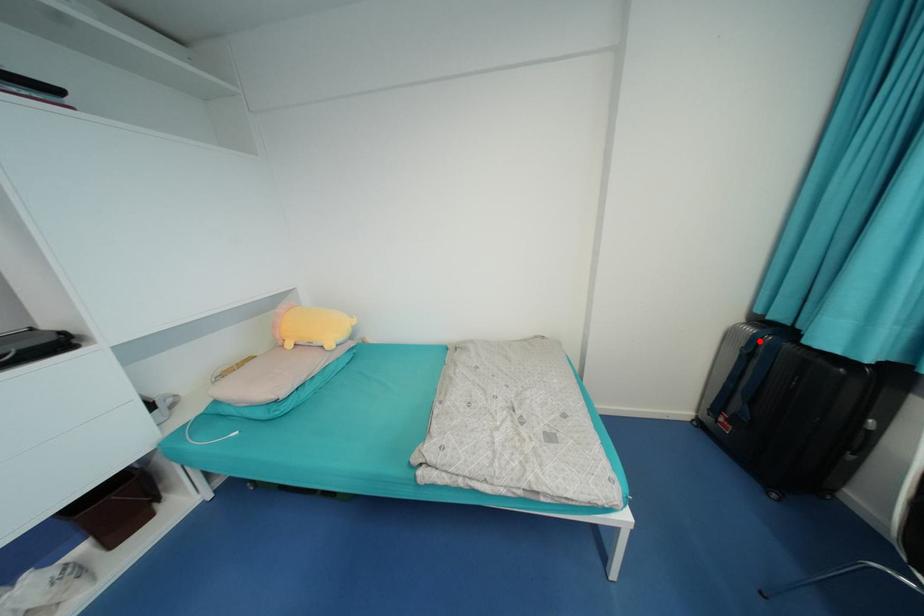
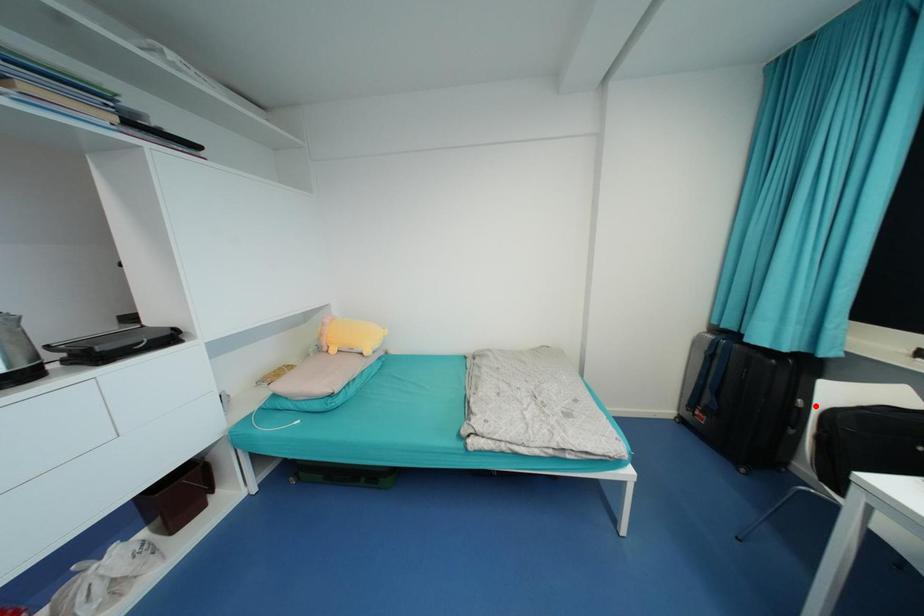
In the scene shown: I am providing you with two images of the same scene from different viewpoints. A red point is marked on the first image and another point is marked on the second image. Is the marked point in image1 the same physical position as the marked point in image2?

No